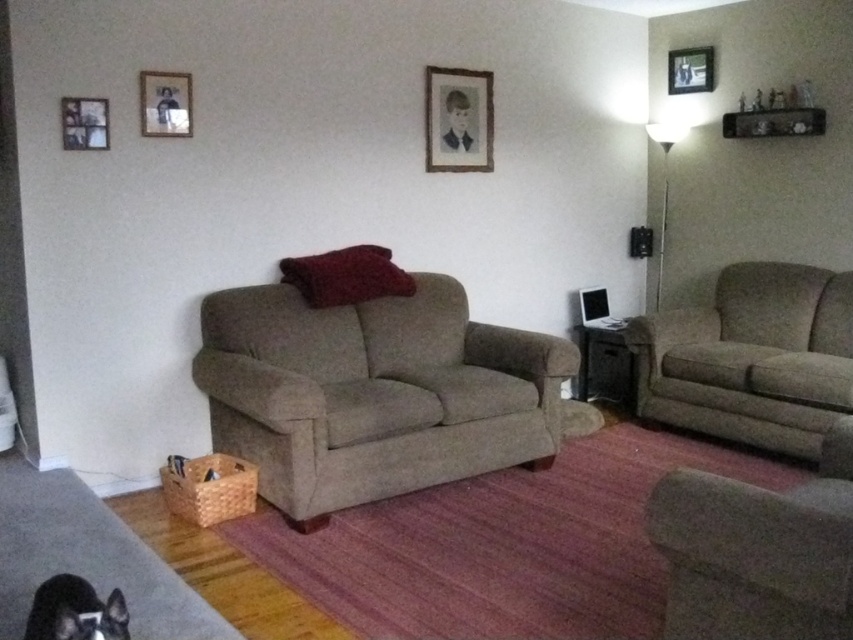
Question: Considering the relative positions of black paper at upper center and wooden picture frame at upper left in the image provided, where is black paper at upper center located with respect to wooden picture frame at upper left?

Choices:
 (A) above
 (B) below

Answer: (A)

Question: Among these points, which one is farthest from the camera?

Choices:
 (A) (357, 298)
 (B) (850, 499)

Answer: (A)

Question: Can you confirm if textured beige couch at right is bigger than black paper at upper center?

Choices:
 (A) no
 (B) yes

Answer: (B)

Question: Estimate the real-world distances between objects in this image. Which object is farther from the fluffy black cat at lower left?

Choices:
 (A) black paper at upper center
 (B) wooden photo frame at upper left
 (C) wooden picture frame at upper left
 (D) black plastic speaker at center

Answer: (D)

Question: Which of the following is the closest to the observer?

Choices:
 (A) (152, 90)
 (B) (103, 138)
 (C) (396, 285)

Answer: (B)

Question: Is beige fabric couch at center positioned at the back of wooden picture frame at upper left?

Choices:
 (A) yes
 (B) no

Answer: (B)